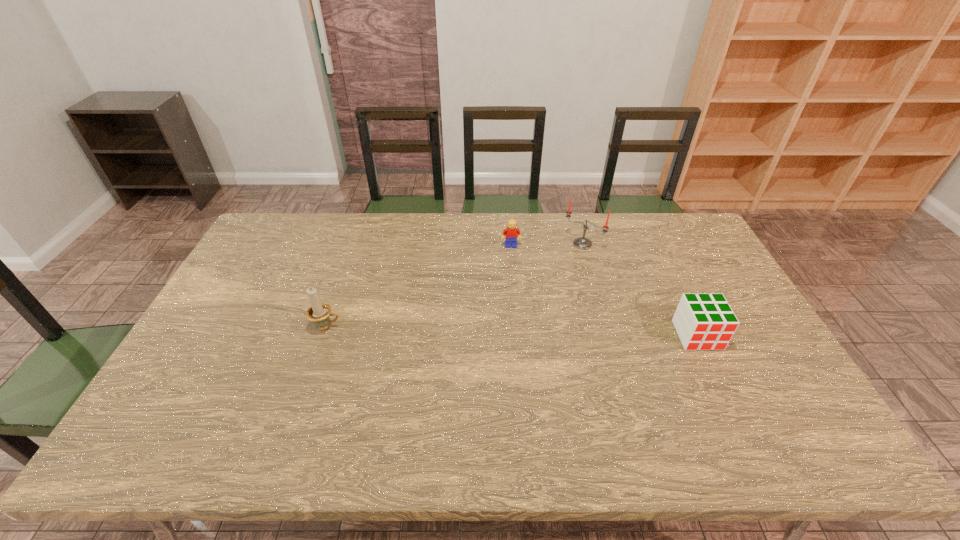
Where is `free spot between the second object from left to right and the candle_holder`? free spot between the second object from left to right and the candle_holder is located at coordinates (419, 287).

Where is `free spot between the candle_holder and the Lego`? Image resolution: width=960 pixels, height=540 pixels. free spot between the candle_holder and the Lego is located at coordinates (419, 287).

Locate an element on the screen. Image resolution: width=960 pixels, height=540 pixels. empty space between the third object from left to right and the Lego is located at coordinates (546, 245).

You are a GUI agent. You are given a task and a screenshot of the screen. Output one action in this format:
    pyautogui.click(x=<x>, y=<y>)
    Task: Click on the vacant region between the Lego and the third object from left to right
    
    Given the screenshot: What is the action you would take?
    pyautogui.click(x=546, y=245)

This screenshot has width=960, height=540. What are the coordinates of `free space between the leftmost object and the third object from left to right` in the screenshot? It's located at (454, 285).

At what (x,y) coordinates should I click in order to perform the action: click on vacant area that lies between the rightmost object and the Lego. Please return your answer as a coordinate pair (x, y). Looking at the image, I should click on (604, 291).

This screenshot has width=960, height=540. I want to click on vacant space in between the third object from left to right and the candle_holder, so click(454, 285).

Find the location of `unoccupied position between the candle_holder and the second object from right to left`. unoccupied position between the candle_holder and the second object from right to left is located at coordinates (454, 285).

This screenshot has width=960, height=540. Find the location of `free point between the cube and the leftmost object`. free point between the cube and the leftmost object is located at coordinates (512, 331).

The height and width of the screenshot is (540, 960). I want to click on object that is the third nearest to the candle_holder, so click(x=703, y=321).